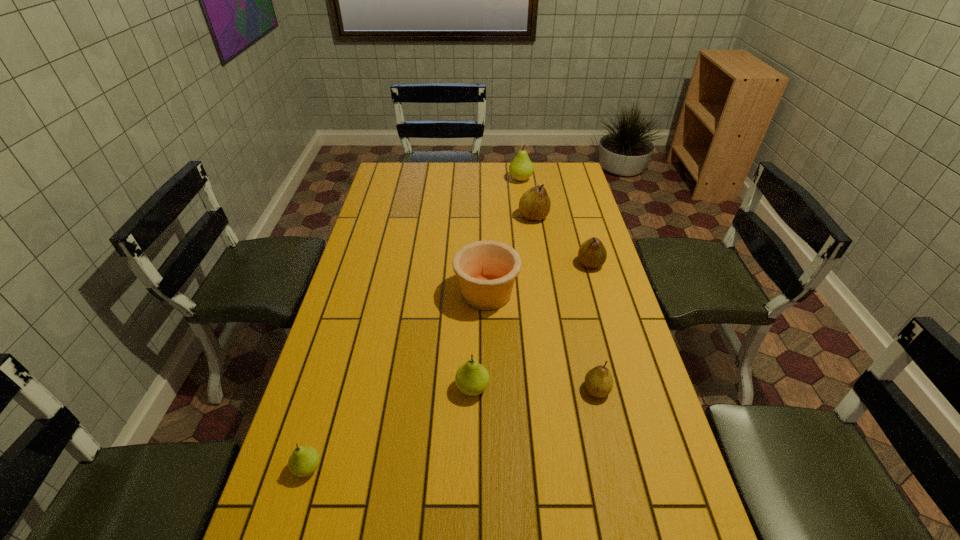
Identify which object is the third nearest to the leftmost object. Please provide its 2D coordinates. Your answer should be formatted as a tuple, i.e. [(x, y)], where the tuple contains the x and y coordinates of a point satisfying the conditions above.

[(598, 381)]

At what (x,y) coordinates should I click in order to perform the action: click on pear that stands as the fifth closest to the second farthest object. Please return your answer as a coordinate pair (x, y). The image size is (960, 540). Looking at the image, I should click on (304, 460).

Where is `pear that is the nearest to the fifth pear from right to left`? pear that is the nearest to the fifth pear from right to left is located at coordinates (598, 381).

This screenshot has width=960, height=540. In order to click on green pear that is the nearest to the biggest green pear in this screenshot , I will do `click(472, 378)`.

The width and height of the screenshot is (960, 540). I want to click on green pear that stands as the second closest to the second smallest green pear, so click(x=521, y=168).

Identify which brown pear is located as the nearest to the pottery. Please provide its 2D coordinates. Your answer should be formatted as a tuple, i.e. [(x, y)], where the tuple contains the x and y coordinates of a point satisfying the conditions above.

[(592, 253)]

Identify which brown pear is located as the nearest to the second biggest green pear. Please provide its 2D coordinates. Your answer should be formatted as a tuple, i.e. [(x, y)], where the tuple contains the x and y coordinates of a point satisfying the conditions above.

[(598, 381)]

The image size is (960, 540). What are the coordinates of `vacant region that satisfies the following two spatial constraints: 1. on the front side of the smallest brown pear; 2. on the right side of the farthest green pear` in the screenshot? It's located at (549, 390).

This screenshot has width=960, height=540. I want to click on vacant space that satisfies the following two spatial constraints: 1. on the back side of the third farthest pear; 2. on the left side of the nearest brown pear, so click(568, 264).